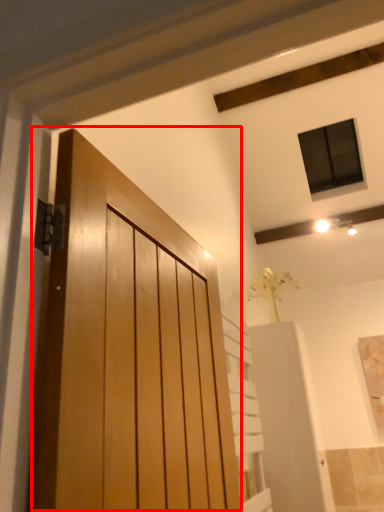
Question: Considering the relative positions of door (annotated by the red box) and elevator in the image provided, where is door (annotated by the red box) located with respect to the staircase?

Choices:
 (A) left
 (B) right

Answer: (A)